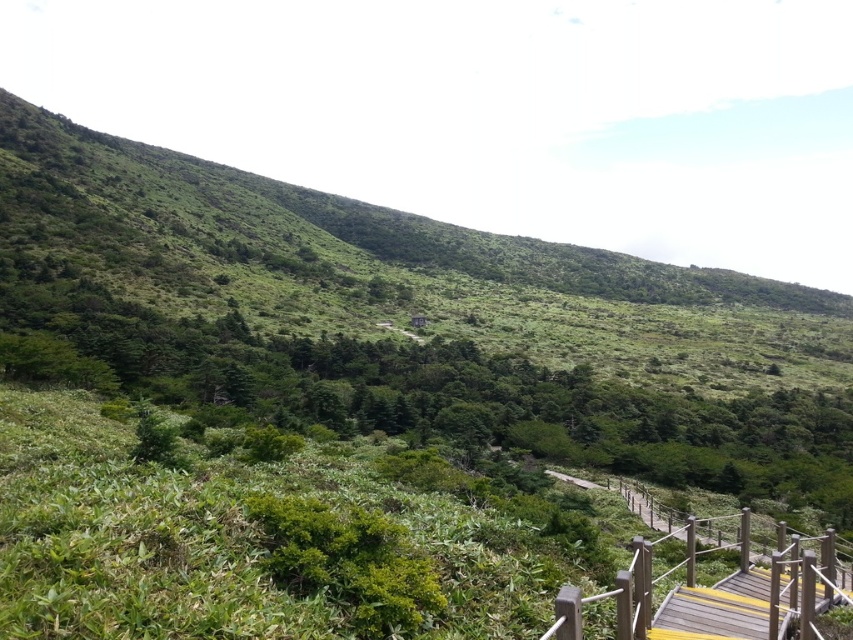
Between wooden rail at lower right and yellow painted wood at lower right, which one has less height?

yellow painted wood at lower right is shorter.

How far apart are wooden rail at lower right and yellow painted wood at lower right?

They are 1.05 meters apart.

Describe the element at coordinates (714, 595) in the screenshot. I see `wooden rail at lower right` at that location.

This screenshot has width=853, height=640. I want to click on wooden rail at lower right, so click(714, 595).